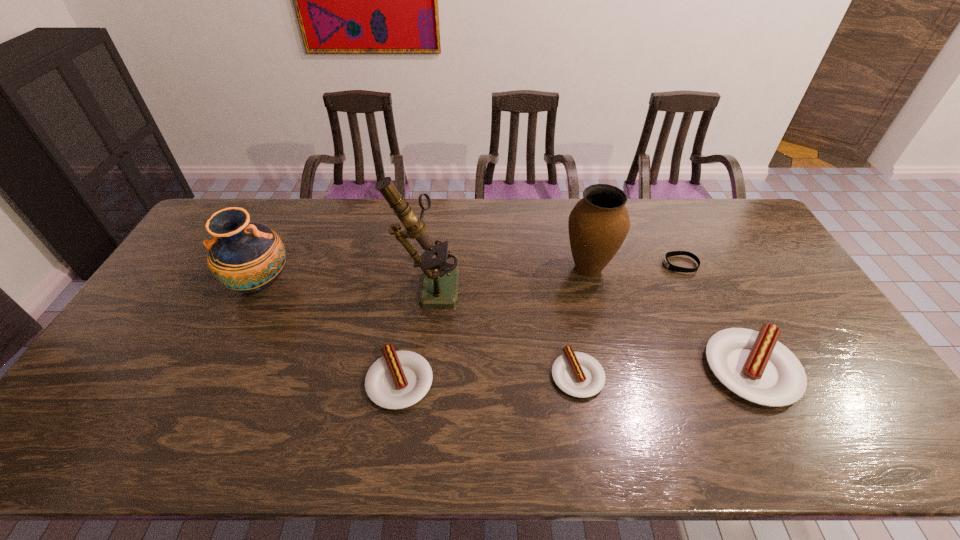
Identify the location of free spot located on the left of the leftmost sausage. This screenshot has height=540, width=960. (211, 381).

Where is `free space located 0.380m on the left of the second sausage from left to right`? The width and height of the screenshot is (960, 540). free space located 0.380m on the left of the second sausage from left to right is located at coordinates (405, 375).

Find the location of a particular element. The height and width of the screenshot is (540, 960). vacant space situated on the back of the fourth shortest object is located at coordinates (705, 278).

Identify the location of vacant space situated 0.290m on the display of the shortest object. The width and height of the screenshot is (960, 540). (575, 265).

Where is `blank area located on the display of the shortest object`? This screenshot has height=540, width=960. blank area located on the display of the shortest object is located at coordinates point(547,265).

At what (x,y) coordinates should I click in order to perform the action: click on vacant space located 0.190m on the display of the shortest object. Please return your answer as a coordinate pair (x, y). The width and height of the screenshot is (960, 540). Looking at the image, I should click on (605, 265).

Find the location of a particular element. The image size is (960, 540). vacant space located 0.360m at the eyepiece of the tallest object is located at coordinates (574, 285).

Where is `free space located 0.330m on the back of the leftmost object`? This screenshot has width=960, height=540. free space located 0.330m on the back of the leftmost object is located at coordinates click(x=300, y=203).

I want to click on vacant point located on the right of the urn, so click(x=643, y=268).

I want to click on object that is at the right edge, so click(x=754, y=365).